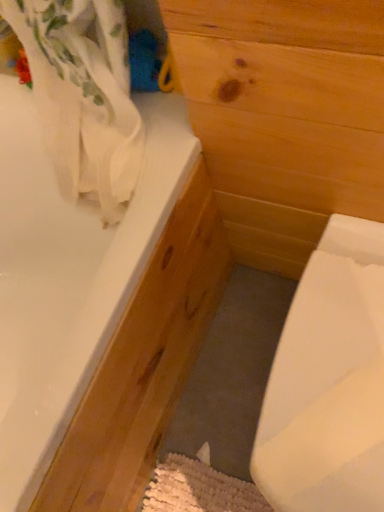
I want to click on free space above white glossy sink at lower right (from a real-world perspective), so click(329, 373).